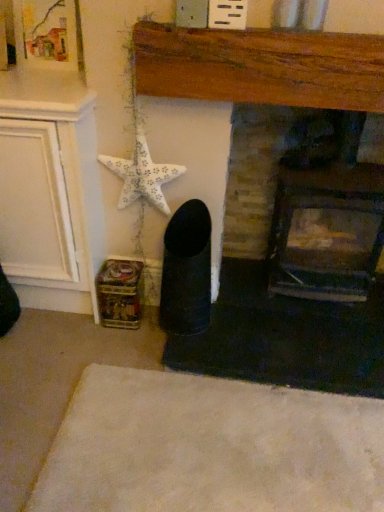
Question: From the image's perspective, would you say white matte starfish at upper left is positioned over white soft rug at lower center?

Choices:
 (A) no
 (B) yes

Answer: (B)

Question: Is white matte starfish at upper left turned away from white soft rug at lower center?

Choices:
 (A) yes
 (B) no

Answer: (B)

Question: Is white matte starfish at upper left taller than white soft rug at lower center?

Choices:
 (A) no
 (B) yes

Answer: (B)

Question: Is white matte starfish at upper left not within white soft rug at lower center?

Choices:
 (A) no
 (B) yes

Answer: (B)

Question: Considering the relative sizes of white matte starfish at upper left and white soft rug at lower center in the image provided, is white matte starfish at upper left wider than white soft rug at lower center?

Choices:
 (A) yes
 (B) no

Answer: (B)

Question: Is white soft rug at lower center surrounded by white matte starfish at upper left?

Choices:
 (A) yes
 (B) no

Answer: (B)

Question: Does white soft rug at lower center have a smaller size compared to white matte starfish at upper left?

Choices:
 (A) no
 (B) yes

Answer: (A)

Question: Can you confirm if white soft rug at lower center is taller than white matte starfish at upper left?

Choices:
 (A) yes
 (B) no

Answer: (B)

Question: From a real-world perspective, is white soft rug at lower center located beneath white matte starfish at upper left?

Choices:
 (A) yes
 (B) no

Answer: (A)

Question: From the image's perspective, is white soft rug at lower center on top of white matte starfish at upper left?

Choices:
 (A) yes
 (B) no

Answer: (B)

Question: Is white soft rug at lower center oriented towards white matte starfish at upper left?

Choices:
 (A) no
 (B) yes

Answer: (A)

Question: Is white soft rug at lower center positioned in front of white matte starfish at upper left?

Choices:
 (A) no
 (B) yes

Answer: (B)

Question: Can we say white matte starfish at upper left lies outside dark brick fireplace at center, the 2th fireplace when ordered from left to right?

Choices:
 (A) yes
 (B) no

Answer: (A)